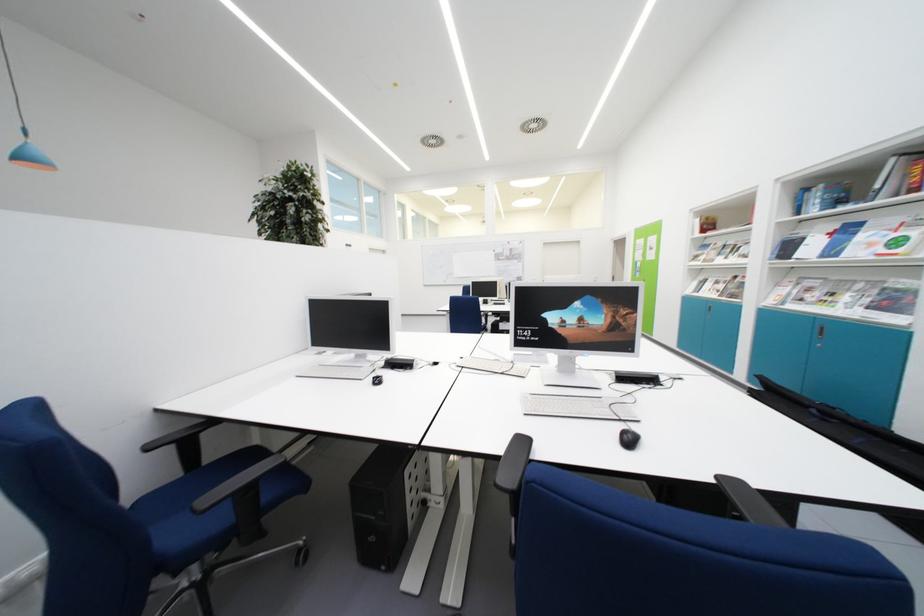
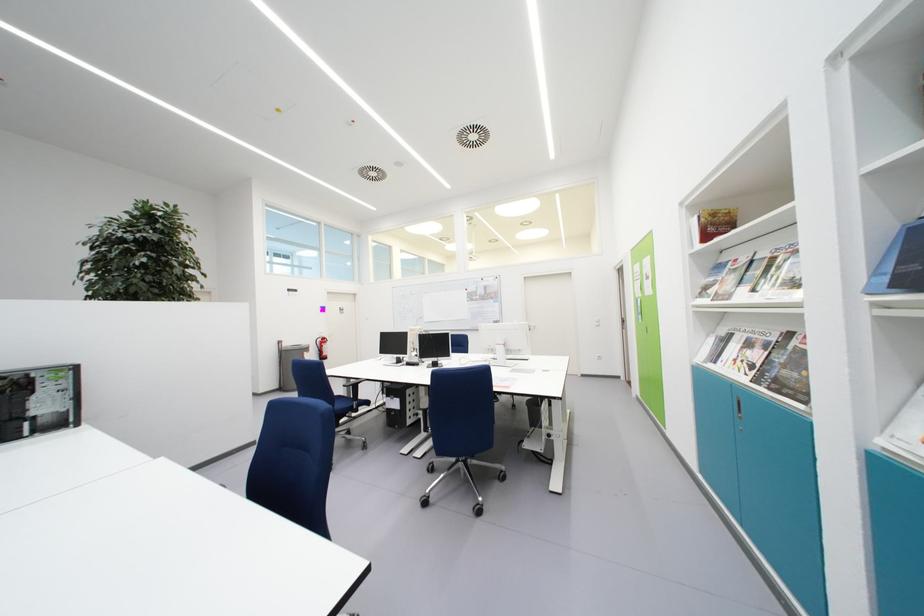
Where in the second image is the point corresponding to point (723, 286) from the first image?

(755, 349)